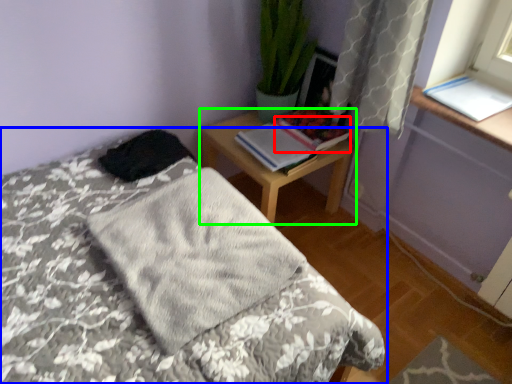
Question: Which is farther away from book (highlighted by a red box)? bed (highlighted by a blue box) or nightstand (highlighted by a green box)?

Choices:
 (A) bed
 (B) nightstand

Answer: (A)